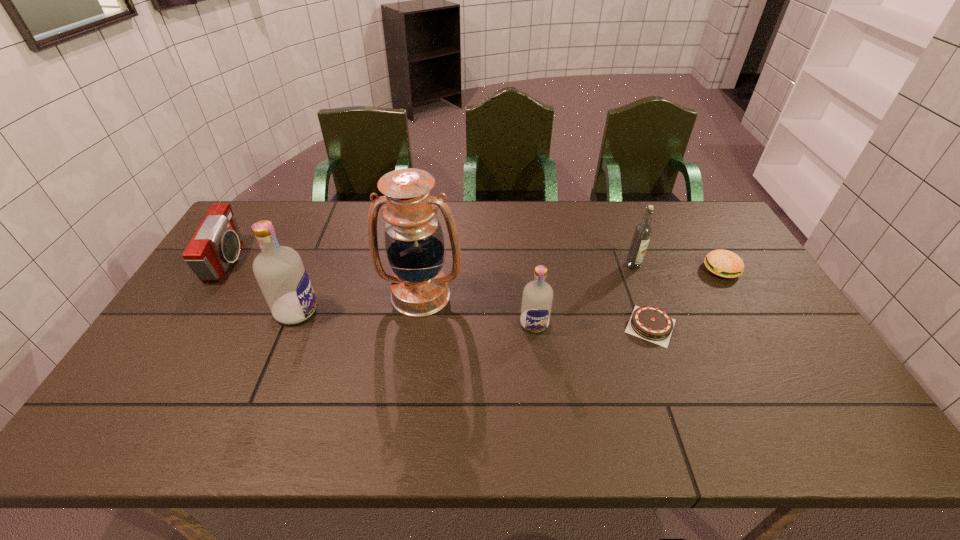
You are a GUI agent. You are given a task and a screenshot of the screen. Output one action in this format:
    pyautogui.click(x=<x>, y=<y>)
    Task: Click on the object that is at the right edge
    This screenshot has width=960, height=540.
    Given the screenshot: What is the action you would take?
    pyautogui.click(x=723, y=263)

The height and width of the screenshot is (540, 960). In order to click on object situated at the far left corner in this screenshot , I will do `click(216, 244)`.

This screenshot has height=540, width=960. In order to click on vacant region at the far edge in this screenshot , I will do `click(609, 213)`.

You are a GUI agent. You are given a task and a screenshot of the screen. Output one action in this format:
    pyautogui.click(x=<x>, y=<y>)
    Task: Click on the free region at the near edge of the desktop
    This screenshot has width=960, height=540.
    Given the screenshot: What is the action you would take?
    pyautogui.click(x=750, y=381)

Where is `vacant space at the left edge of the desktop`? vacant space at the left edge of the desktop is located at coordinates (183, 314).

You are a GUI agent. You are given a task and a screenshot of the screen. Output one action in this format:
    pyautogui.click(x=<x>, y=<y>)
    Task: Click on the vacant space at the right edge of the desktop
    The height and width of the screenshot is (540, 960).
    Given the screenshot: What is the action you would take?
    [x=750, y=271]

In the image, there is a desktop. At what (x,y) coordinates should I click in order to perform the action: click on vacant space at the far left corner. Please return your answer as a coordinate pair (x, y). This screenshot has width=960, height=540. Looking at the image, I should click on (275, 218).

The image size is (960, 540). What are the coordinates of `blank region between the fourth object from left to right and the shortest object` in the screenshot? It's located at (592, 325).

Identify the location of free space between the rightmost vodka and the sixth object from right to left. This screenshot has width=960, height=540. (465, 288).

Where is `free space between the oil lamp and the patty`? This screenshot has height=540, width=960. free space between the oil lamp and the patty is located at coordinates (571, 282).